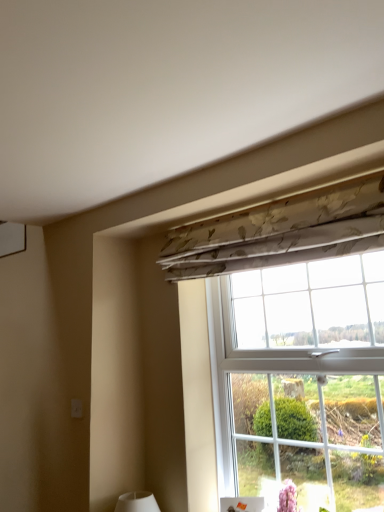
Question: Could you tell me if floral fabric curtain at upper center is turned towards floral fabric at upper center?

Choices:
 (A) yes
 (B) no

Answer: (B)

Question: Is floral fabric curtain at upper center placed right next to floral fabric at upper center?

Choices:
 (A) no
 (B) yes

Answer: (A)

Question: Is floral fabric curtain at upper center far away from floral fabric at upper center?

Choices:
 (A) no
 (B) yes

Answer: (A)

Question: Considering the relative sizes of floral fabric curtain at upper center and floral fabric at upper center in the image provided, is floral fabric curtain at upper center thinner than floral fabric at upper center?

Choices:
 (A) yes
 (B) no

Answer: (A)

Question: Can you confirm if floral fabric curtain at upper center is bigger than floral fabric at upper center?

Choices:
 (A) yes
 (B) no

Answer: (B)

Question: Is floral fabric curtain at upper center outside floral fabric at upper center?

Choices:
 (A) yes
 (B) no

Answer: (A)

Question: Could you tell me if floral fabric at upper center is facing floral fabric curtain at upper center?

Choices:
 (A) yes
 (B) no

Answer: (A)

Question: Considering the relative sizes of floral fabric at upper center and floral fabric curtain at upper center in the image provided, is floral fabric at upper center thinner than floral fabric curtain at upper center?

Choices:
 (A) no
 (B) yes

Answer: (A)

Question: From a real-world perspective, is floral fabric at upper center under floral fabric curtain at upper center?

Choices:
 (A) yes
 (B) no

Answer: (A)

Question: Does floral fabric at upper center lie in front of floral fabric curtain at upper center?

Choices:
 (A) yes
 (B) no

Answer: (A)

Question: From the image's perspective, is floral fabric at upper center located above floral fabric curtain at upper center?

Choices:
 (A) no
 (B) yes

Answer: (A)

Question: Considering the relative positions of floral fabric at upper center and floral fabric curtain at upper center in the image provided, is floral fabric at upper center to the left of floral fabric curtain at upper center from the viewer's perspective?

Choices:
 (A) no
 (B) yes

Answer: (A)

Question: In terms of width, does floral fabric at upper center look wider or thinner when compared to floral fabric curtain at upper center?

Choices:
 (A) wide
 (B) thin

Answer: (A)